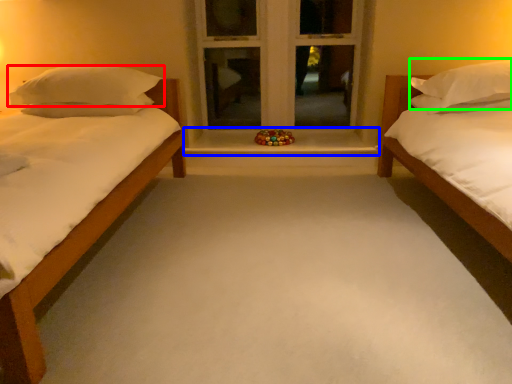
Question: Which object is positioned farthest from pillow (highlighted by a red box)? Select from window sill (highlighted by a blue box) and pillow (highlighted by a green box).

Choices:
 (A) window sill
 (B) pillow

Answer: (B)